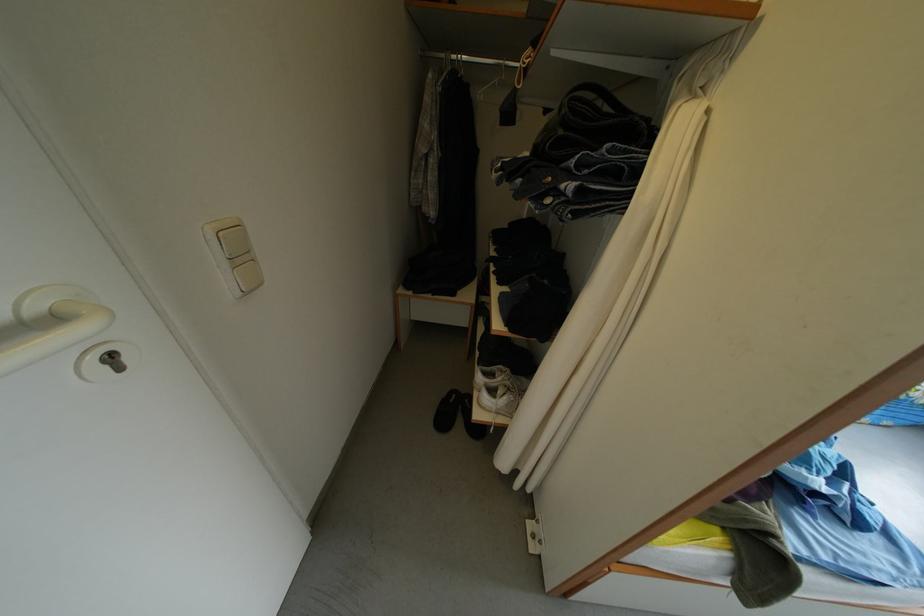
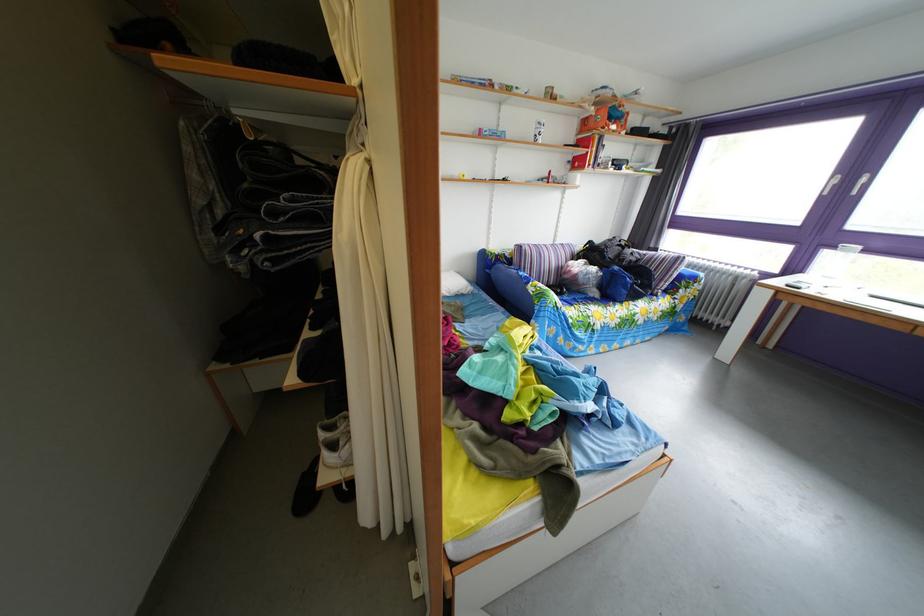
Question: The first image is from the beginning of the video and the second image is from the end. How did the camera likely rotate when shooting the video?

Choices:
 (A) Left
 (B) Right
 (C) Up
 (D) Down

Answer: (B)